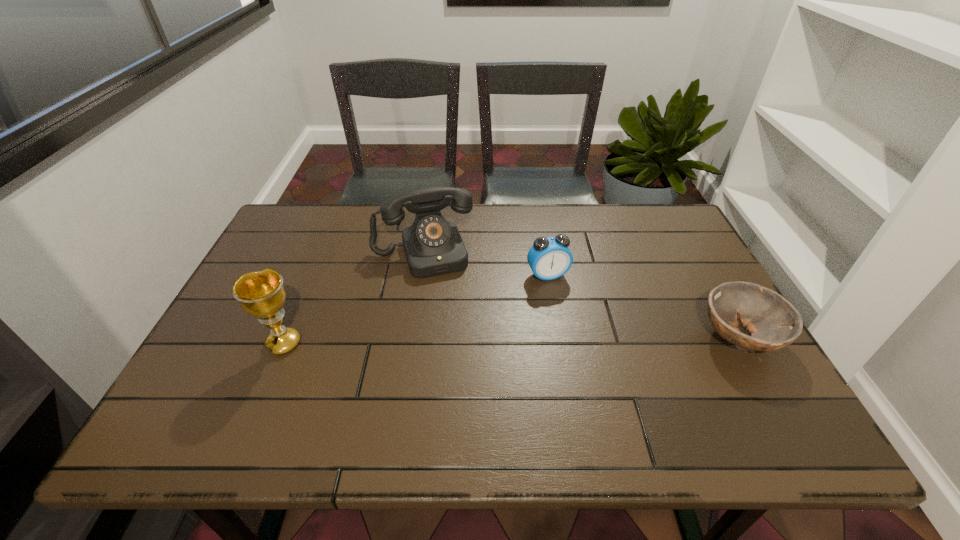
This screenshot has height=540, width=960. Identify the location of the leftmost object. (261, 294).

Locate an element on the screen. the rightmost object is located at coordinates (774, 323).

You are a GUI agent. You are given a task and a screenshot of the screen. Output one action in this format:
    pyautogui.click(x=<x>, y=<y>)
    Task: Click on the shortest object
    
    Given the screenshot: What is the action you would take?
    pyautogui.click(x=774, y=323)

At what (x,y) coordinates should I click in order to perform the action: click on the third object from right to left. Please return your answer as a coordinate pair (x, y). The width and height of the screenshot is (960, 540). Looking at the image, I should click on (433, 246).

Where is `the third object from left to right`? This screenshot has height=540, width=960. the third object from left to right is located at coordinates (549, 258).

You are a GUI agent. You are given a task and a screenshot of the screen. Output one action in this format:
    pyautogui.click(x=<x>, y=<y>)
    Task: Click on the second shortest object
    The width and height of the screenshot is (960, 540).
    Given the screenshot: What is the action you would take?
    pyautogui.click(x=549, y=258)

Identify the location of free location located on the front of the leftmost object. (267, 382).

Locate an element on the screen. free space located on the left of the rightmost object is located at coordinates (662, 337).

Where is `free space located 0.260m on the dial of the third object from right to left`? The width and height of the screenshot is (960, 540). free space located 0.260m on the dial of the third object from right to left is located at coordinates (454, 348).

In order to click on vacant space located 0.180m on the dial of the third object from right to left in this screenshot , I will do `click(446, 324)`.